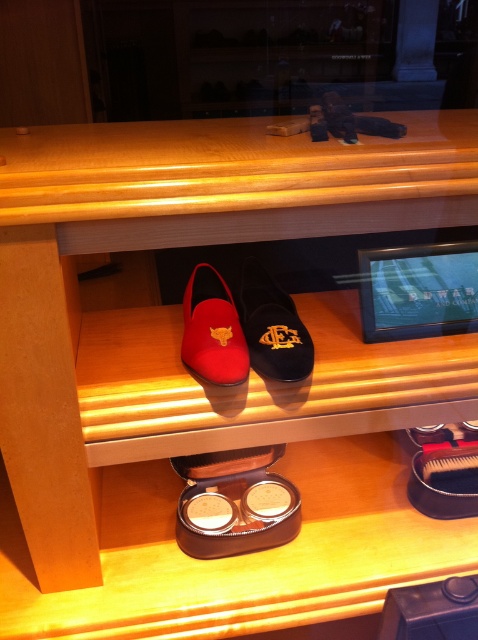
Question: Where is velvet/black shoe at center located in relation to matte red leather shoe at center in the image?

Choices:
 (A) below
 (B) above

Answer: (B)

Question: Does velvet/black shoe at center appear on the right side of matte red leather shoe at center?

Choices:
 (A) yes
 (B) no

Answer: (A)

Question: Considering the relative positions of velvet/black shoe at center and matte red leather shoe at center in the image provided, where is velvet/black shoe at center located with respect to matte red leather shoe at center?

Choices:
 (A) left
 (B) right

Answer: (B)